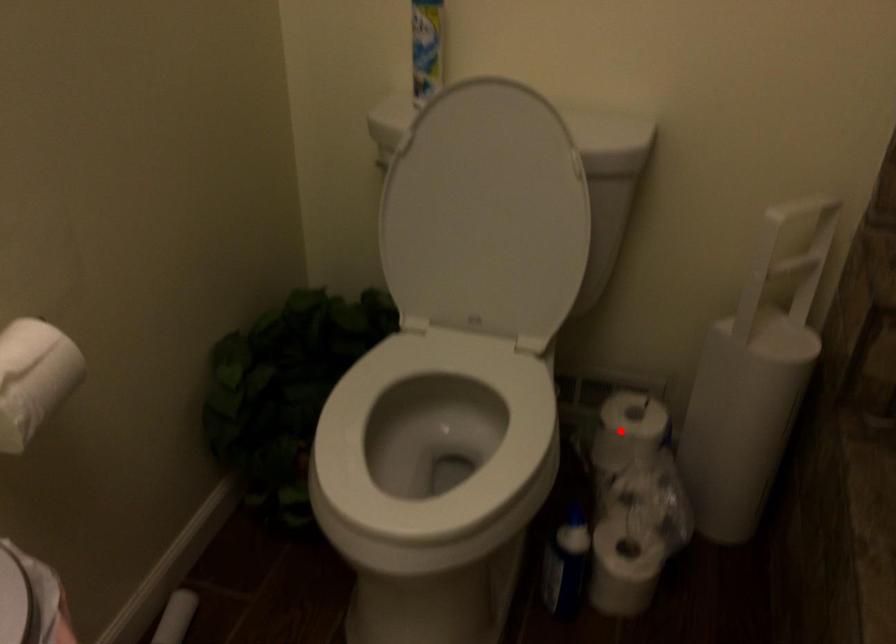
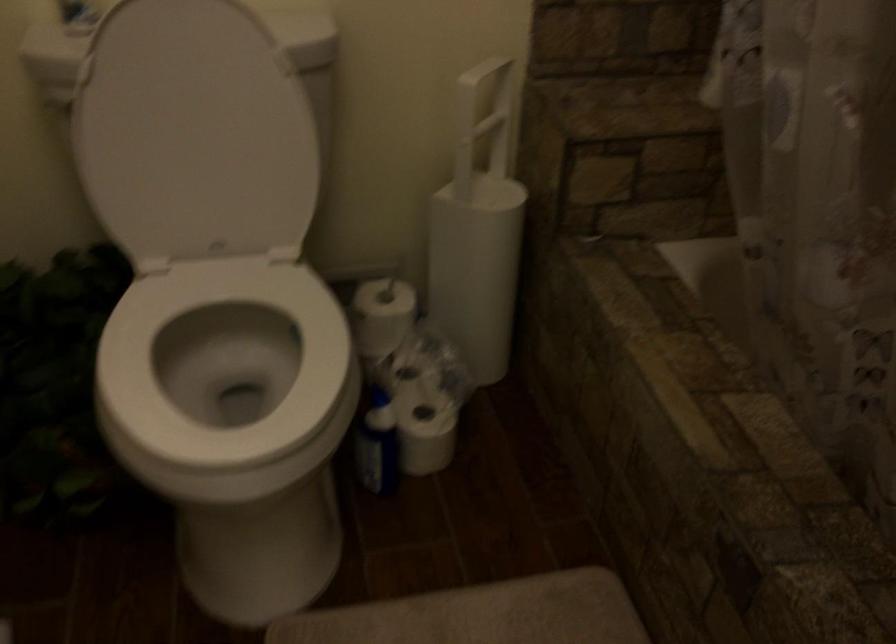
In the second image, find the point that corresponds to the highlighted location in the first image.

(382, 316)